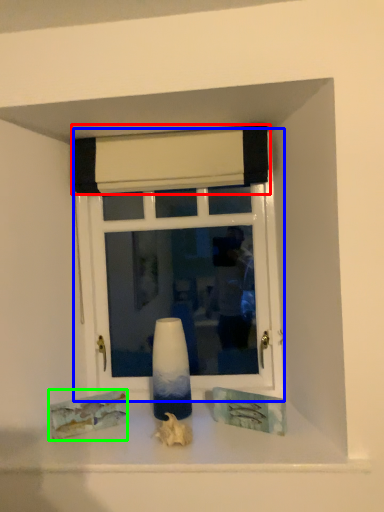
Question: Which object is positioned closest to curtain (highlighted by a red box)? Select from window (highlighted by a blue box) and art (highlighted by a green box).

Choices:
 (A) window
 (B) art

Answer: (A)